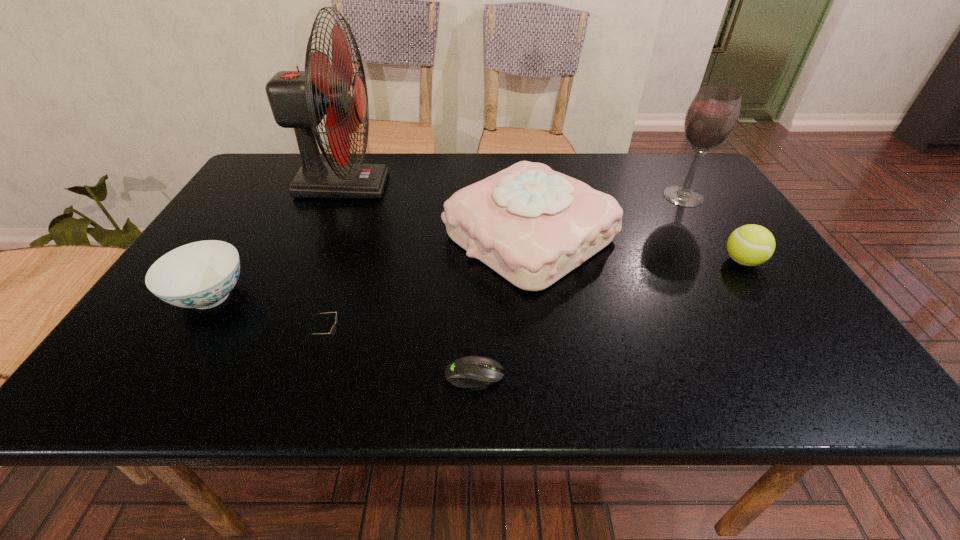
Locate an element on the screen. The image size is (960, 540). vacant region located 0.200m on the back of the tennis ball is located at coordinates (704, 203).

Identify the location of vacant space located on the front of the chinaware. Image resolution: width=960 pixels, height=540 pixels. (172, 359).

Where is `free point located in front of the lenses of the sixth tallest object`? Image resolution: width=960 pixels, height=540 pixels. free point located in front of the lenses of the sixth tallest object is located at coordinates (528, 339).

Identify the location of vacant space located 0.060m on the wheel side of the shortest object. (537, 375).

In order to click on fan that is at the far edge in this screenshot , I will do `click(298, 99)`.

Identify the location of alcohol that is at the far edge. The width and height of the screenshot is (960, 540). (713, 113).

The image size is (960, 540). I want to click on cake that is positioned at the far edge, so click(532, 225).

Find the location of `sunglasses at the near edge`. sunglasses at the near edge is located at coordinates (333, 329).

Find the location of `computer mouse at the near edge`. computer mouse at the near edge is located at coordinates (x=471, y=371).

You are a GUI agent. You are given a task and a screenshot of the screen. Output one action in this format:
    pyautogui.click(x=<x>, y=<y>)
    Task: Click on the fan that is positioned at the left edge
    This screenshot has width=960, height=540.
    Given the screenshot: What is the action you would take?
    pyautogui.click(x=298, y=99)